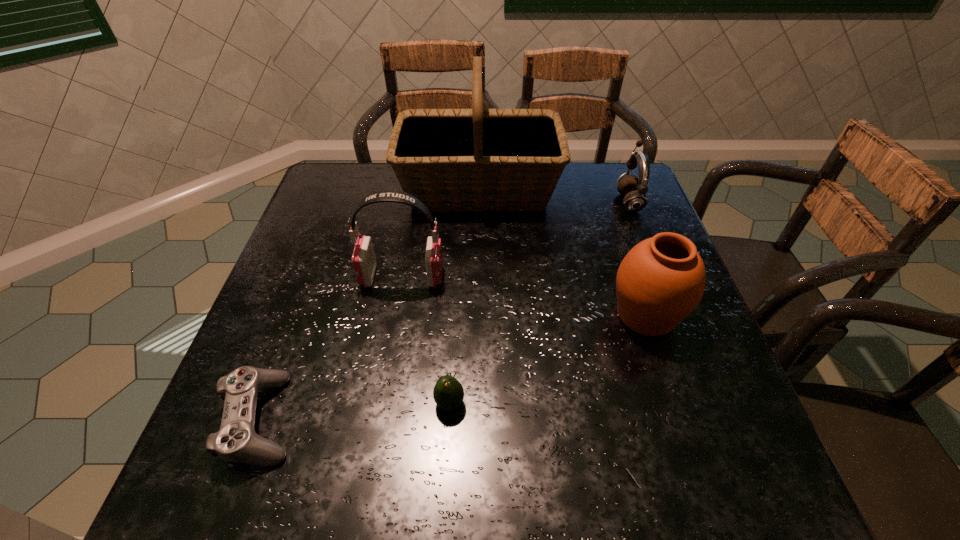
You are a GUI agent. You are given a task and a screenshot of the screen. Output one action in this format:
    pyautogui.click(x=<x>, y=<y>)
    Task: Click on the tallest object
    This screenshot has width=960, height=540.
    Given the screenshot: What is the action you would take?
    pyautogui.click(x=477, y=159)

Find the location of a particular element. This screenshot has width=960, height=540. the left earphone is located at coordinates (364, 262).

Where is `the taller earphone`? The image size is (960, 540). the taller earphone is located at coordinates (364, 262).

Identify the location of the third tallest object. [661, 280].

Where is `the fourth tallest object`? This screenshot has height=540, width=960. the fourth tallest object is located at coordinates (634, 189).

Find the location of a particular element. This screenshot has height=540, width=960. the farther earphone is located at coordinates point(634,189).

I want to click on the second shortest object, so click(x=448, y=393).

Find the location of `the leftmost object`. the leftmost object is located at coordinates (237, 441).

The width and height of the screenshot is (960, 540). I want to click on the shortest object, so pyautogui.click(x=237, y=441).

Where is `free space located by the handle of the tallest object`? This screenshot has width=960, height=540. free space located by the handle of the tallest object is located at coordinates (599, 189).